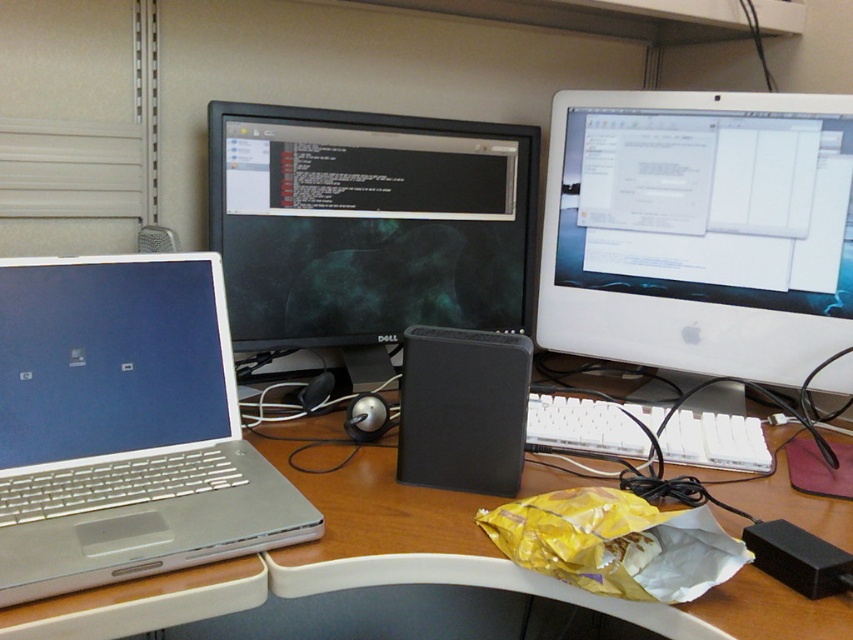
Question: Which of the following is the farthest from the observer?

Choices:
 (A) white plastic keyboard at center
 (B) black plastic speaker at center
 (C) wooden desk at center
 (D) white glossy monitor at upper right

Answer: (D)

Question: Does white glossy monitor at upper right appear on the right side of white plastic keyboard at center?

Choices:
 (A) no
 (B) yes

Answer: (B)

Question: Is white glossy monitor at upper right positioned in front of black glossy monitor at center?

Choices:
 (A) yes
 (B) no

Answer: (A)

Question: Does black glossy monitor at center appear over white plastic keyboard at center?

Choices:
 (A) yes
 (B) no

Answer: (A)

Question: Which of the following is the closest to the observer?

Choices:
 (A) black glossy monitor at center
 (B) white plastic keyboard at center
 (C) silver metallic laptop at left

Answer: (C)

Question: Among these points, which one is nearest to the camera?

Choices:
 (A) (161, 579)
 (B) (555, 419)
 (C) (850, 310)
 (D) (460, 422)

Answer: (A)